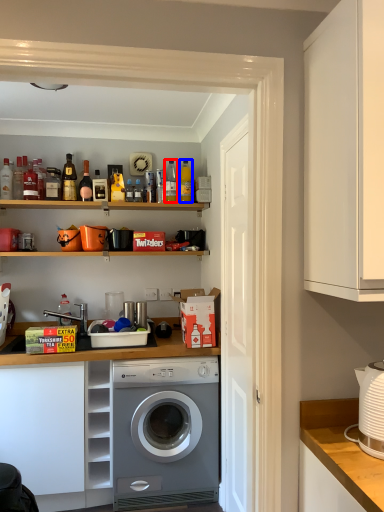
Question: Which object is closer to the camera taking this photo, bottle (highlighted by a red box) or bottle (highlighted by a blue box)?

Choices:
 (A) bottle
 (B) bottle

Answer: (B)